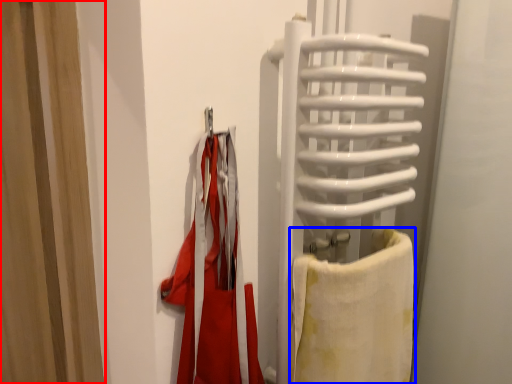
Question: Which point is further to the camera, curtain (highlighted by a red box) or towel (highlighted by a blue box)?

Choices:
 (A) curtain
 (B) towel

Answer: (A)